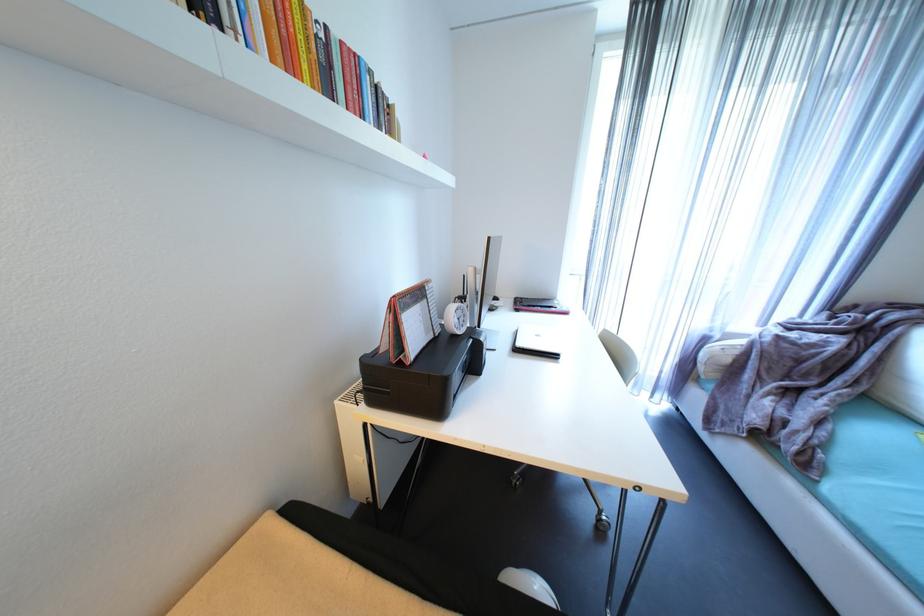
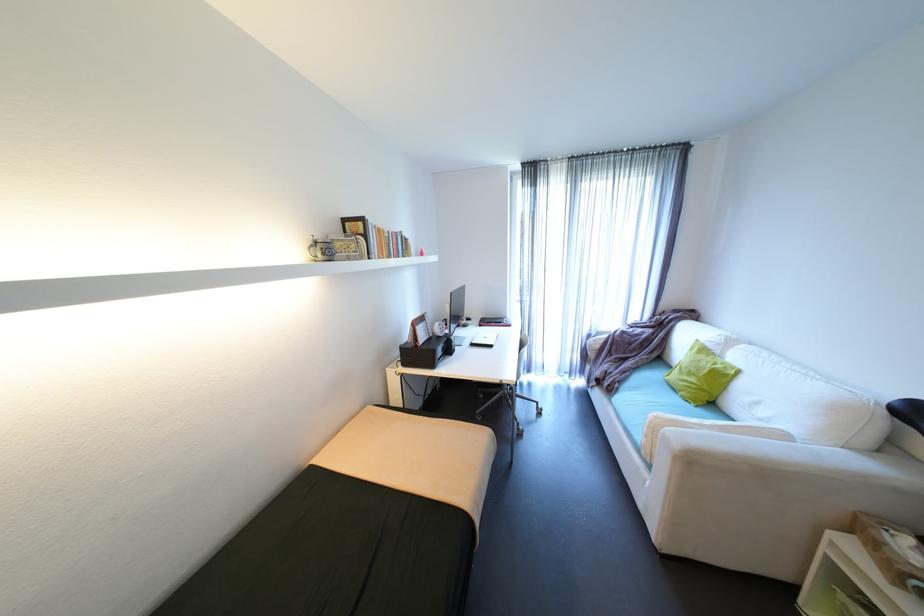
Where in the second image is the point corresponding to (x=558, y=307) from the first image?

(508, 323)